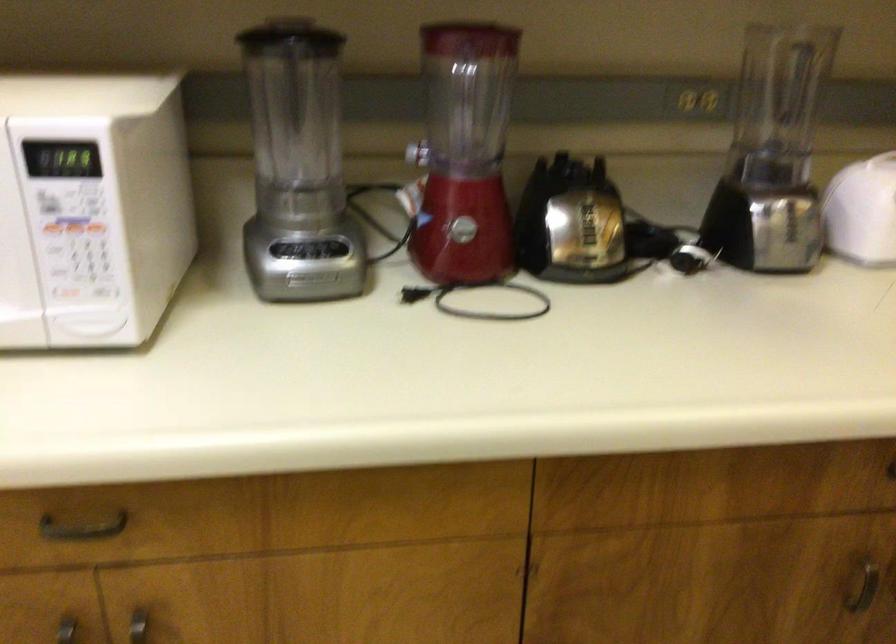
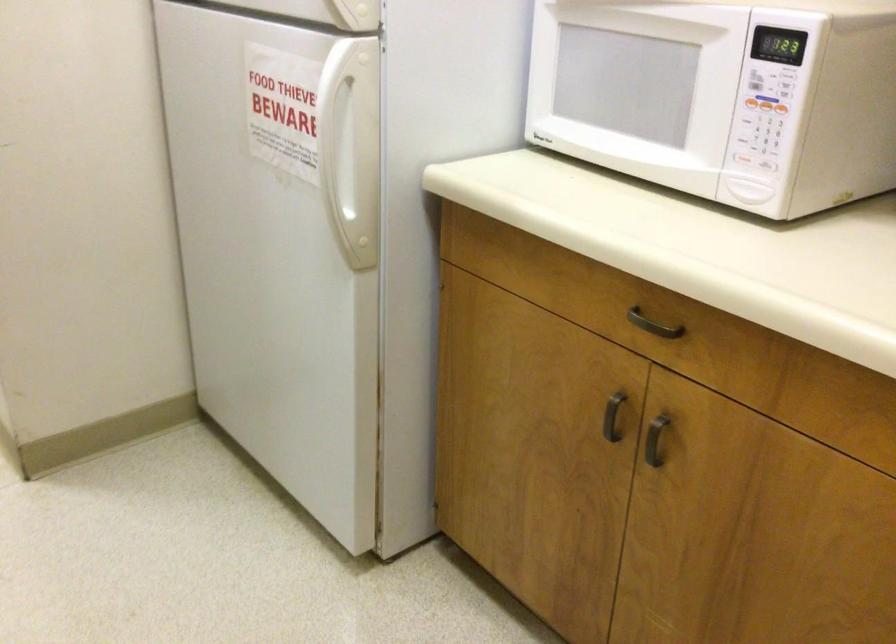
The point at (75, 230) is marked in the first image. Where is the corresponding point in the second image?

(765, 104)